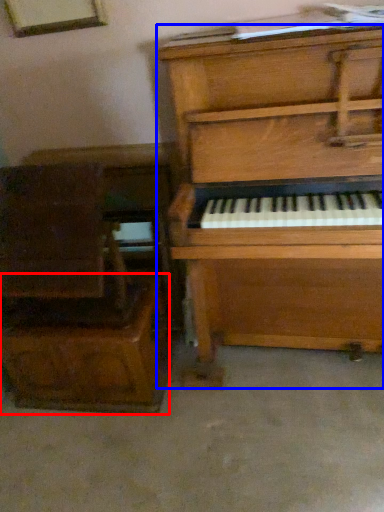
Question: Which of the following is the closest to the observer, drawer (highlighted by a red box) or piano (highlighted by a blue box)?

Choices:
 (A) drawer
 (B) piano

Answer: (B)